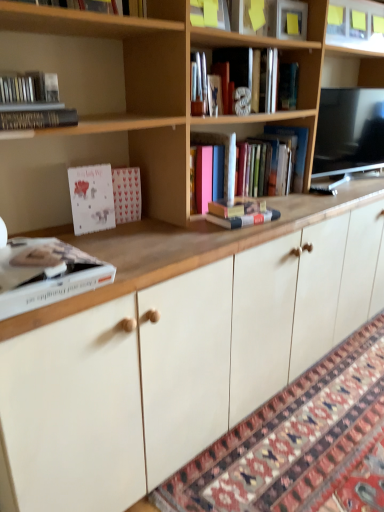
In order to click on vacant space that is in between white matte book at lower left, acting as the 5th book starting from the right, and hardcover book at center, the 5th book positioned from the left in this screenshot , I will do `click(178, 237)`.